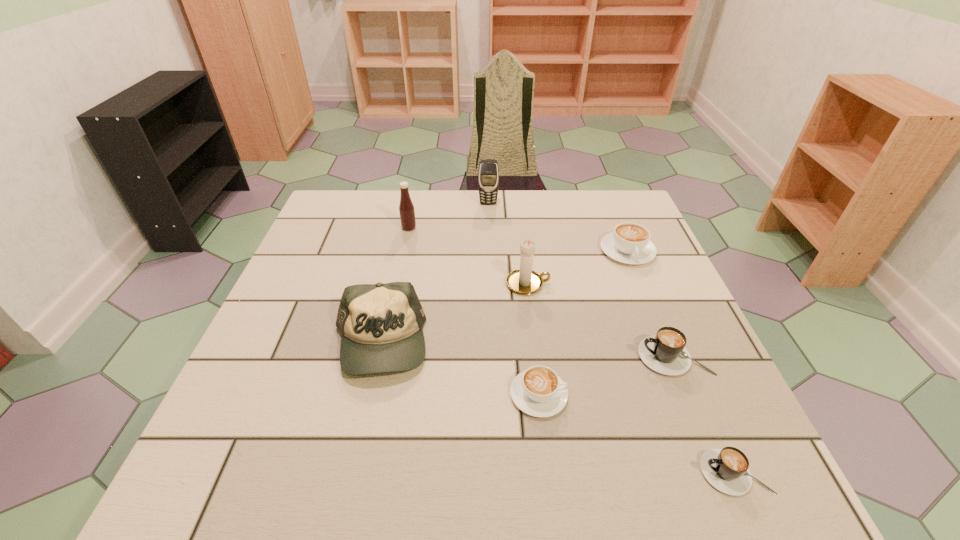
This screenshot has height=540, width=960. I want to click on the farthest object, so click(488, 177).

Identify the location of the third object from left to right. (488, 177).

The width and height of the screenshot is (960, 540). Find the location of `white Tabasco sauce`. white Tabasco sauce is located at coordinates (406, 208).

You are a GUI agent. You are given a task and a screenshot of the screen. Output one action in this format:
    pyautogui.click(x=<x>, y=<y>)
    Task: Click on the second farthest object
    The width and height of the screenshot is (960, 540).
    Given the screenshot: What is the action you would take?
    pyautogui.click(x=406, y=208)

Identify the location of white candle holder. The image size is (960, 540). (524, 281).

At what (x,y) coordinates should I click in order to perform the action: click on the fifth nearest object. Please return your answer as a coordinate pair (x, y). The height and width of the screenshot is (540, 960). Looking at the image, I should click on (524, 281).

The image size is (960, 540). I want to click on green baseball cap, so click(x=381, y=325).

At what (x,y) coordinates should I click in order to perform the action: click on baseball cap. Please return your answer as a coordinate pair (x, y). The height and width of the screenshot is (540, 960). Looking at the image, I should click on (381, 325).

The image size is (960, 540). I want to click on the bigger white cappuccino, so click(629, 243).

Locate an element on the screen. This screenshot has height=540, width=960. the farthest cappuccino is located at coordinates (629, 243).